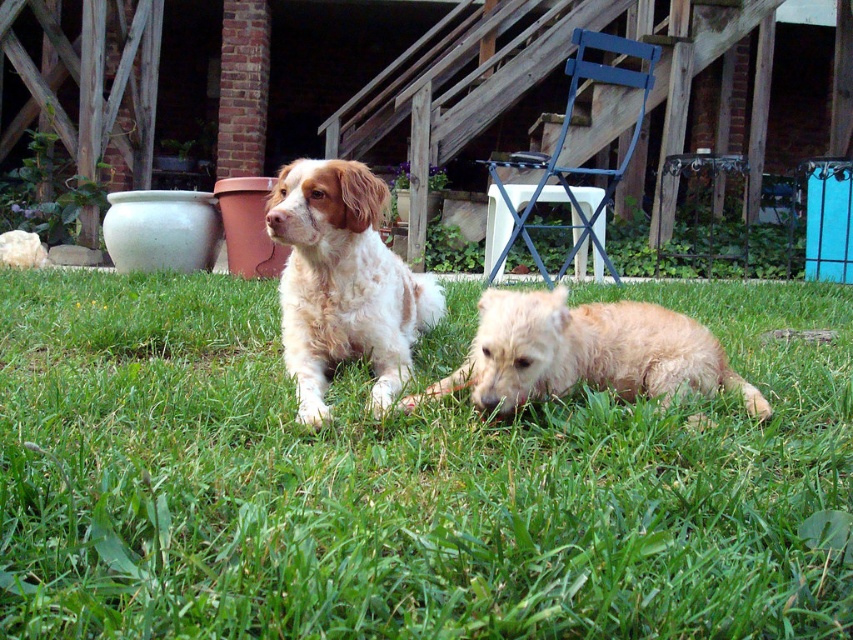
Question: Which object is the farthest from the green grass at center?

Choices:
 (A) fuzzy golden dog at lower center
 (B) light brown fur dog at center

Answer: (B)

Question: Can you confirm if green grass at center is wider than light brown fur dog at center?

Choices:
 (A) no
 (B) yes

Answer: (B)

Question: Is light brown fur dog at center bigger than fuzzy golden dog at lower center?

Choices:
 (A) no
 (B) yes

Answer: (B)

Question: Which of the following is the closest to the observer?

Choices:
 (A) (x=643, y=316)
 (B) (x=817, y=588)

Answer: (B)

Question: Which point appears closest to the camera in this image?

Choices:
 (A) (553, 349)
 (B) (318, 332)
 (C) (827, 525)

Answer: (C)

Question: Is green grass at center thinner than light brown fur dog at center?

Choices:
 (A) yes
 (B) no

Answer: (B)